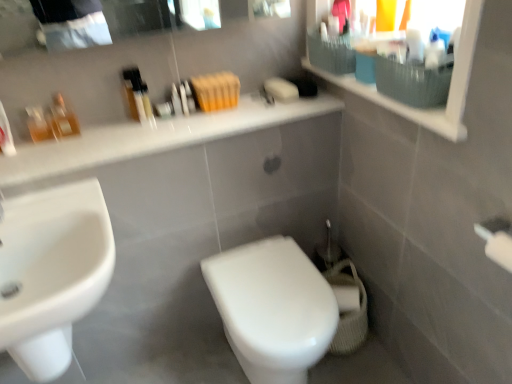
Question: Is white glossy sink at lower left placed right next to translucent plastic bottles at upper center, the 3th toiletry in the left-to-right sequence?

Choices:
 (A) no
 (B) yes

Answer: (A)

Question: Is white glossy sink at lower left wider than translucent plastic bottles at upper center, the 3th toiletry in the left-to-right sequence?

Choices:
 (A) yes
 (B) no

Answer: (A)

Question: Would you say translucent plastic bottles at upper center, the 3th toiletry in the left-to-right sequence, is part of white glossy sink at lower left's contents?

Choices:
 (A) no
 (B) yes

Answer: (A)

Question: Considering the relative positions of white glossy sink at lower left and translucent plastic bottles at upper center, positioned as the first toiletry in right-to-left order, in the image provided, is white glossy sink at lower left behind translucent plastic bottles at upper center, positioned as the first toiletry in right-to-left order,?

Choices:
 (A) yes
 (B) no

Answer: (B)

Question: From the image's perspective, is white glossy sink at lower left located beneath translucent plastic bottles at upper center, positioned as the first toiletry in right-to-left order?

Choices:
 (A) no
 (B) yes

Answer: (B)

Question: Is white glossy sink at lower left positioned before translucent plastic bottles at upper center, positioned as the first toiletry in right-to-left order?

Choices:
 (A) no
 (B) yes

Answer: (B)

Question: Is matte white medicine cabinet at upper right not close to white glossy countertop at upper center?

Choices:
 (A) yes
 (B) no

Answer: (B)

Question: Is matte white medicine cabinet at upper right turned away from white glossy countertop at upper center?

Choices:
 (A) no
 (B) yes

Answer: (A)

Question: Is matte white medicine cabinet at upper right closer to camera compared to white glossy countertop at upper center?

Choices:
 (A) no
 (B) yes

Answer: (B)

Question: Does matte white medicine cabinet at upper right have a lesser height compared to white glossy countertop at upper center?

Choices:
 (A) no
 (B) yes

Answer: (A)

Question: Can you confirm if matte white medicine cabinet at upper right is bigger than white glossy countertop at upper center?

Choices:
 (A) no
 (B) yes

Answer: (A)

Question: Can you confirm if matte white medicine cabinet at upper right is thinner than white glossy countertop at upper center?

Choices:
 (A) yes
 (B) no

Answer: (A)

Question: Does white glossy toilet at center have a lesser height compared to translucent plastic bottles at upper center, positioned as the first toiletry in right-to-left order?

Choices:
 (A) no
 (B) yes

Answer: (A)